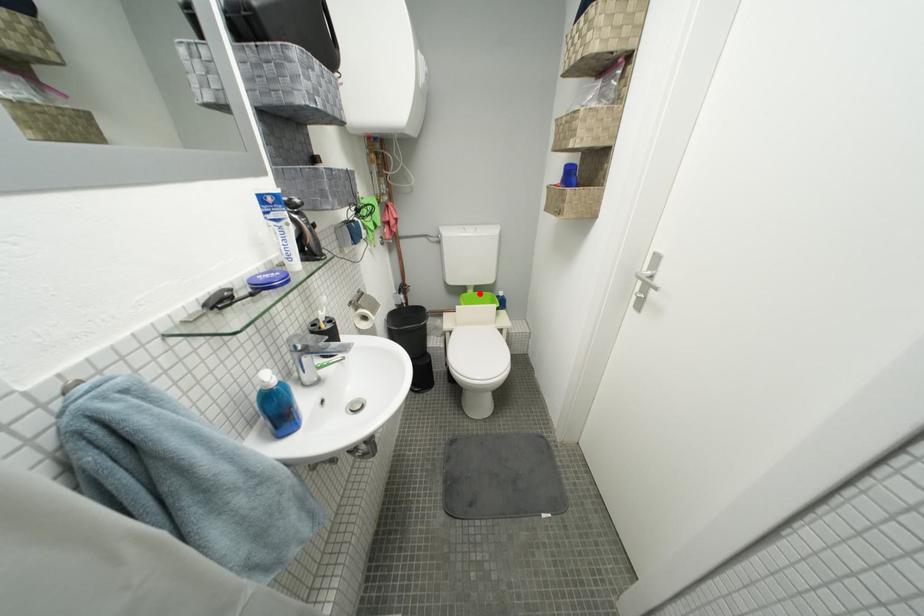
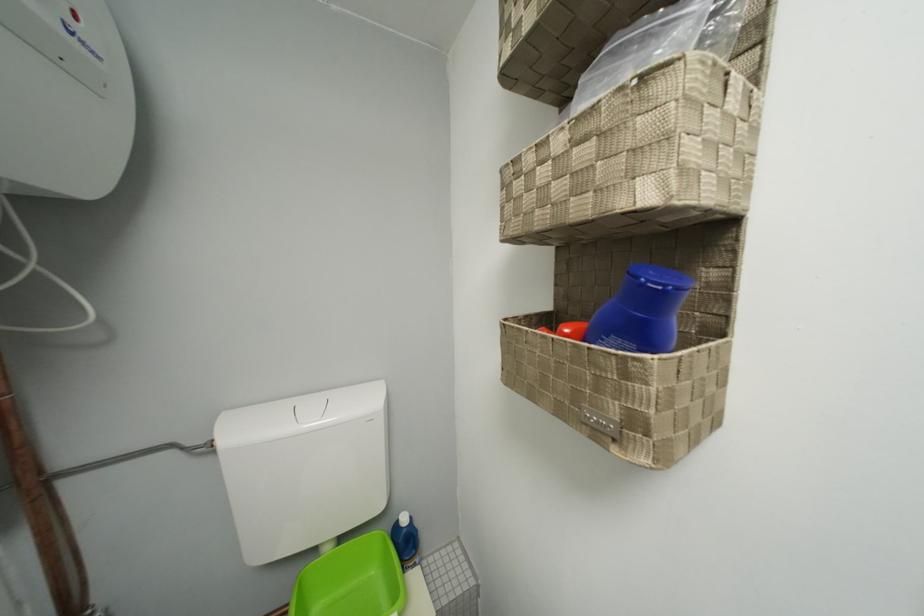
The point at the highlighted location is marked in the first image. Where is the corresponding point in the second image?

(335, 552)